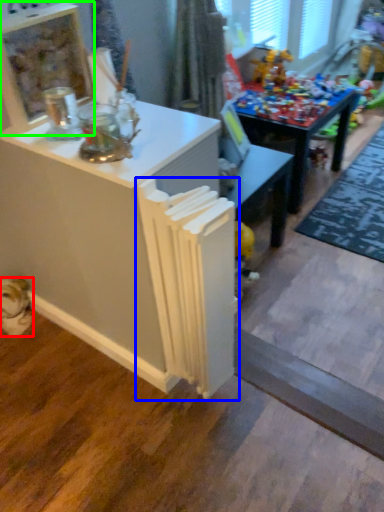
Question: Which object is positioned closest to animal (highlighted by a red box)? Select from radiator (highlighted by a blue box) and shelf (highlighted by a green box).

Choices:
 (A) radiator
 (B) shelf

Answer: (A)